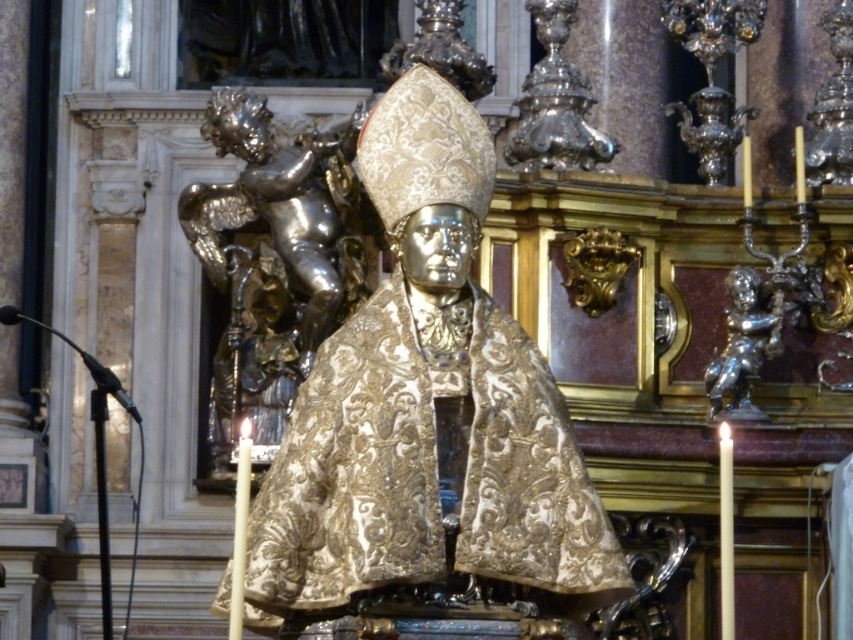
You are standing in front of the statue and want to place a small bouquet of flowers at the base of the shiny silver cherub at left. Given that you can only reach up to 5 feet, can you determine if you can place the bouquet without needing a ladder?

The shiny silver cherub at left is 272.28 feet from viewer. Since the cherub is over 272 feet away, you would need a ladder or some assistance to reach it, as the distance is far beyond your 5 feet reach.

From the picture: You are an art conservator examining the statue. You need to clean both the gold embroidered cape at center and the shiny silver cherub at right. Which object should you clean first if you want to start with the one that is closer to you?

The gold embroidered cape at center should be cleaned first because it is in front of the shiny silver cherub at right, making it closer to you.